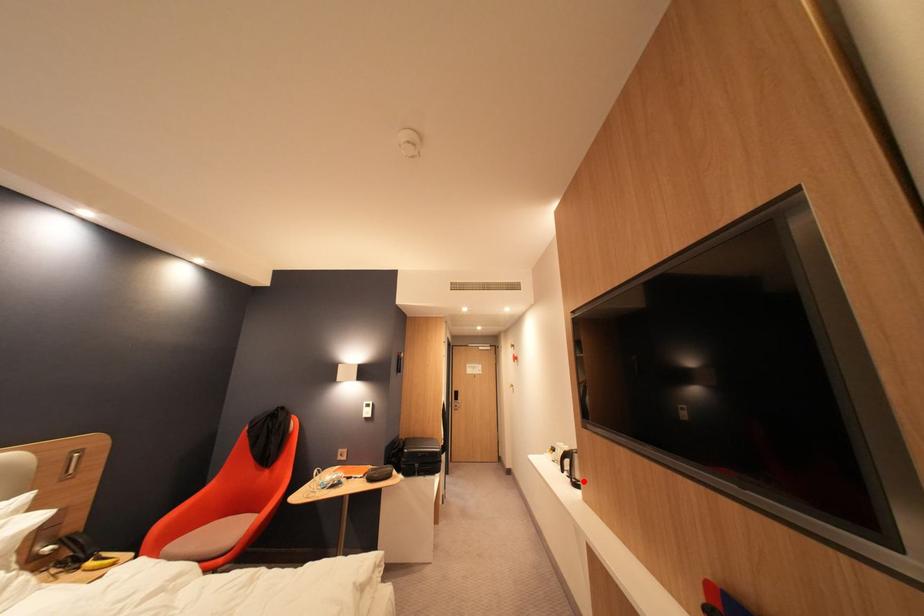
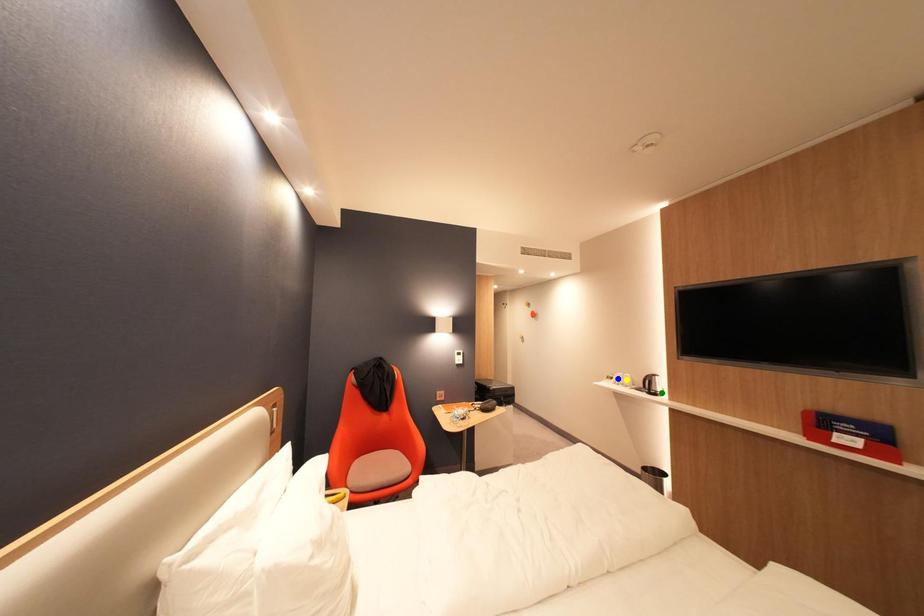
Question: I am providing you with two images of the same scene from different viewpoints. A red point is marked on the first image. You are given multiple points on the second image. Can you choose the point in image 2 that corresponds to the point in image 1?

Choices:
 (A) yellow point
 (B) blue point
 (C) green point

Answer: (C)